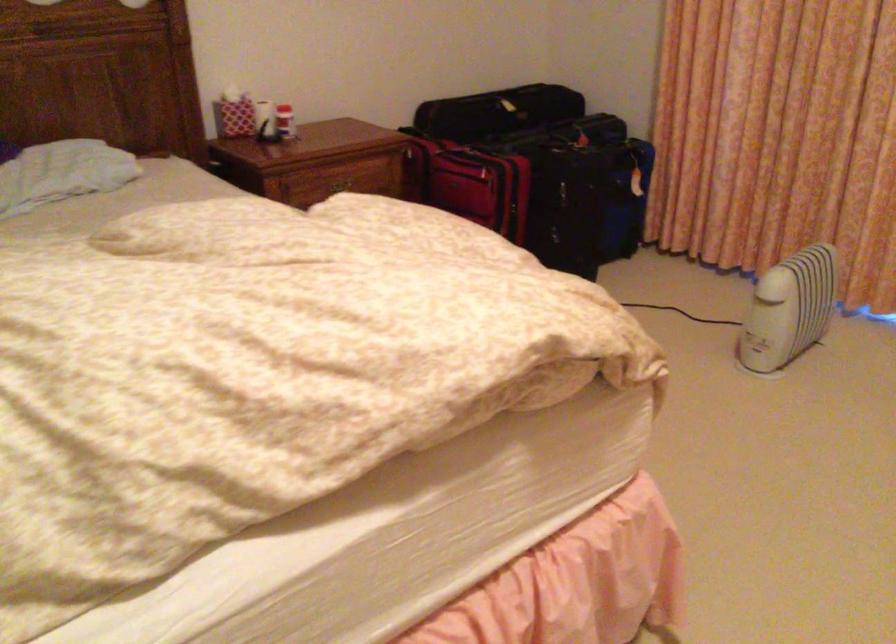
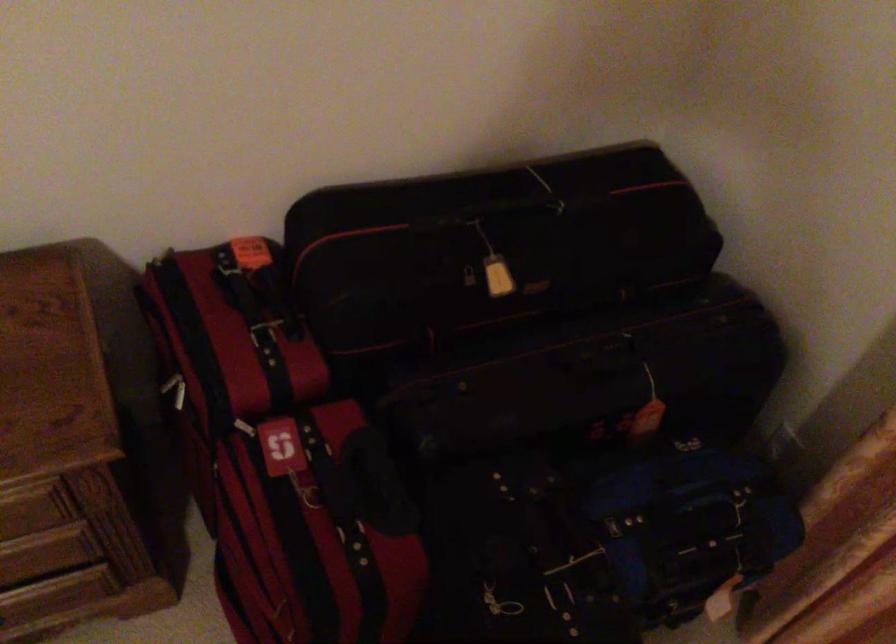
Question: The images are taken continuously from a first-person perspective. In which direction are you moving?

Choices:
 (A) Left
 (B) Right
 (C) Forward
 (D) Backward

Answer: (C)